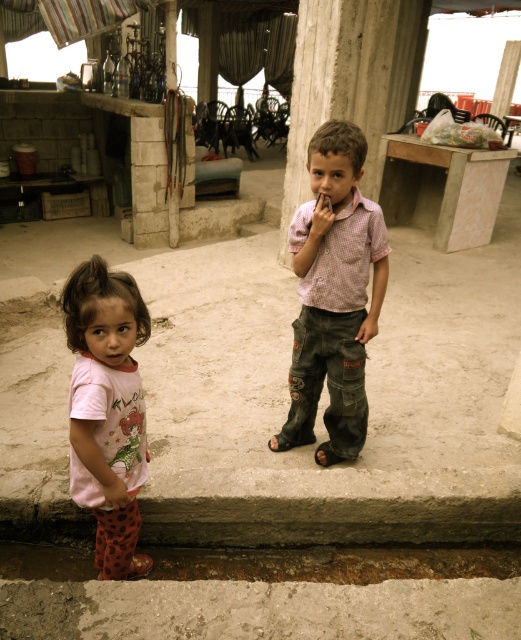
Can you confirm if checkered fabric shirt at center is taller than pink cotton shirt at lower left?

Indeed, checkered fabric shirt at center has a greater height compared to pink cotton shirt at lower left.

Does checkered fabric shirt at center have a lesser height compared to pink cotton shirt at lower left?

Incorrect, checkered fabric shirt at center's height does not fall short of pink cotton shirt at lower left's.

Describe the element at coordinates (333, 292) in the screenshot. I see `checkered fabric shirt at center` at that location.

The width and height of the screenshot is (521, 640). I want to click on checkered fabric shirt at center, so [x=333, y=292].

Based on the photo, is checkered fabric shirt at center shorter than gray concrete curb at lower center?

No.

Between checkered fabric shirt at center and gray concrete curb at lower center, which one appears on the left side from the viewer's perspective?

checkered fabric shirt at center is more to the left.

Does point (315, 300) lie behind point (178, 516)?

Yes, point (315, 300) is behind point (178, 516).

You are a GUI agent. You are given a task and a screenshot of the screen. Output one action in this format:
    pyautogui.click(x=<x>, y=<y>)
    Task: Click on the checkered fabric shirt at center
    
    Given the screenshot: What is the action you would take?
    pyautogui.click(x=333, y=292)

Between gray concrete curb at lower center and black leather sandal at lower center, which one has less height?

With less height is black leather sandal at lower center.

Locate an element on the screen. The height and width of the screenshot is (640, 521). gray concrete curb at lower center is located at coordinates (327, 518).